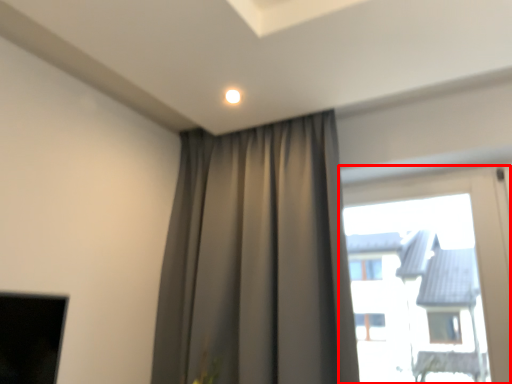
Question: From the image's perspective, considering the relative positions of window (annotated by the red box) and curtain in the image provided, where is window (annotated by the red box) located with respect to the staircase?

Choices:
 (A) above
 (B) below

Answer: (B)